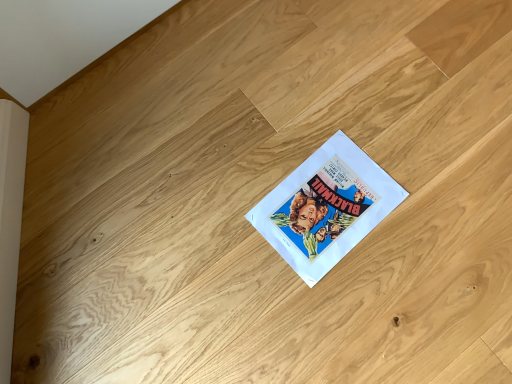
Image resolution: width=512 pixels, height=384 pixels. I want to click on vacant location below white paper at center (from a real-world perspective), so click(324, 211).